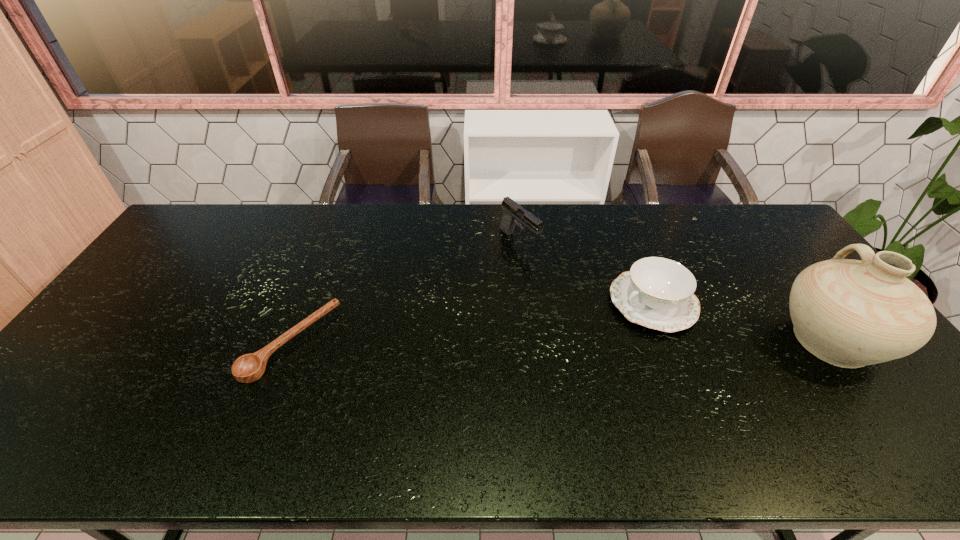
I want to click on wooden spoon, so click(248, 368).

The width and height of the screenshot is (960, 540). I want to click on the shortest object, so click(x=248, y=368).

Where is `pottery`? Image resolution: width=960 pixels, height=540 pixels. pottery is located at coordinates (849, 313).

In order to click on the tallest object in this screenshot , I will do `click(849, 313)`.

Locate an element on the screen. This screenshot has height=540, width=960. the second object from right to left is located at coordinates (658, 293).

Image resolution: width=960 pixels, height=540 pixels. I want to click on chinaware, so click(x=658, y=293).

Find the location of a particular element. The image size is (960, 540). pistol is located at coordinates (512, 210).

Where is `the third shortest object`? the third shortest object is located at coordinates (512, 210).

Find the location of a particular element. free spot located on the right of the wooden spoon is located at coordinates (480, 343).

The width and height of the screenshot is (960, 540). What are the coordinates of `vacant space located on the left of the tallest object` in the screenshot? It's located at (674, 339).